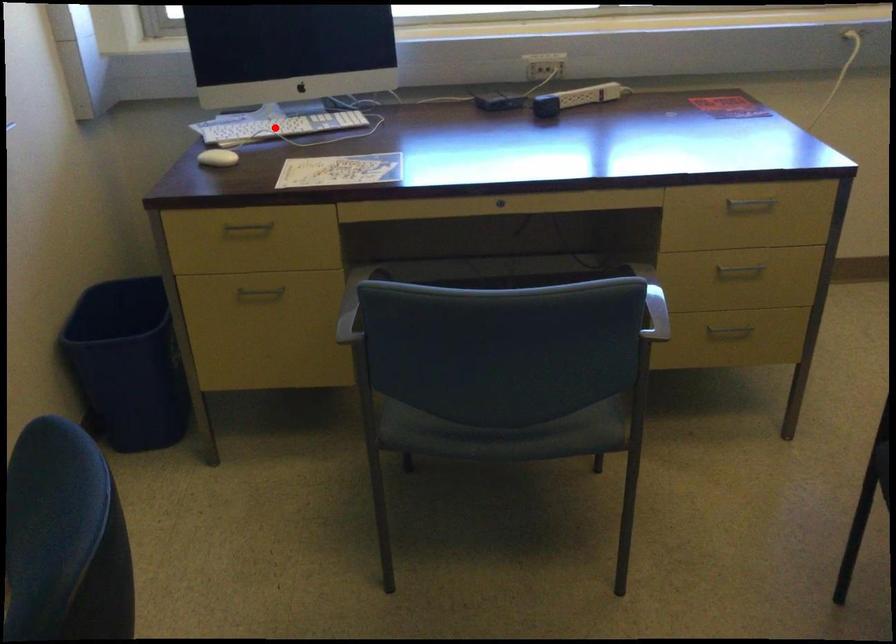
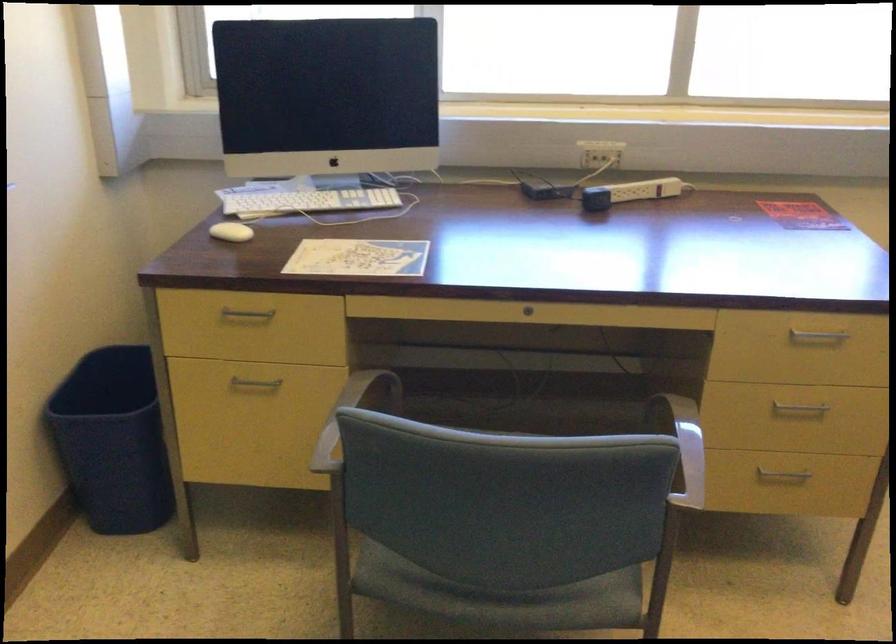
Question: I am providing you with two images of the same scene from different viewpoints. A red point is marked on the first image. Is the red point's position out of view in image 2?

Choices:
 (A) Yes
 (B) No

Answer: (B)